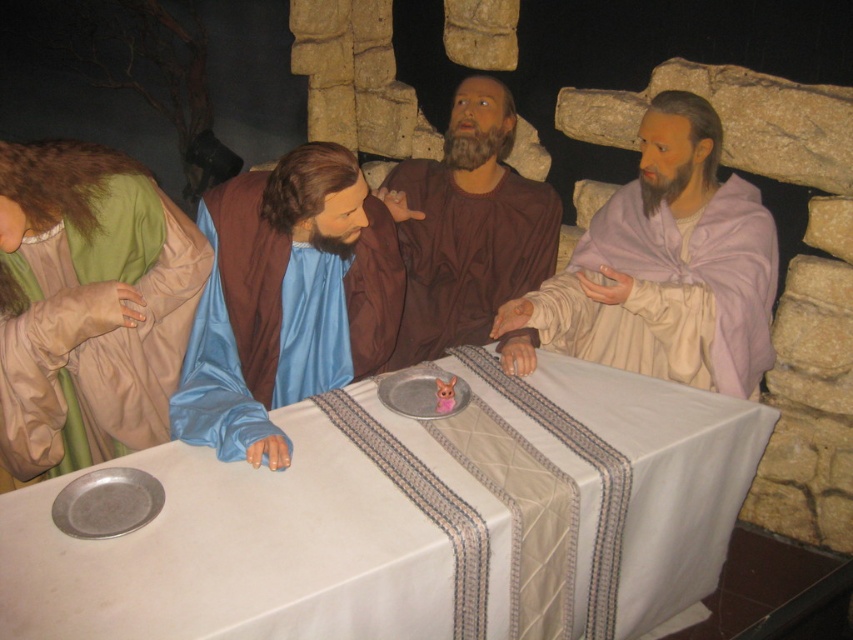
Question: Observing the image, what is the correct spatial positioning of green matte robe at left in reference to blue satin robe at center?

Choices:
 (A) right
 (B) left

Answer: (B)

Question: Observing the image, what is the correct spatial positioning of green matte robe at left in reference to brown matte robe at center?

Choices:
 (A) below
 (B) above

Answer: (A)

Question: Is white cloth at center to the right of light purple silk robe at right from the viewer's perspective?

Choices:
 (A) yes
 (B) no

Answer: (B)

Question: Which point is farther to the camera?

Choices:
 (A) (459, 259)
 (B) (488, 492)
 (C) (105, 205)
 (D) (234, 378)

Answer: (A)

Question: Among these points, which one is nearest to the camera?

Choices:
 (A) (495, 93)
 (B) (9, 353)
 (C) (386, 520)

Answer: (C)

Question: Which of the following is the farthest from the observer?

Choices:
 (A) (367, 513)
 (B) (633, 243)
 (C) (254, 380)
 (D) (132, 216)

Answer: (B)